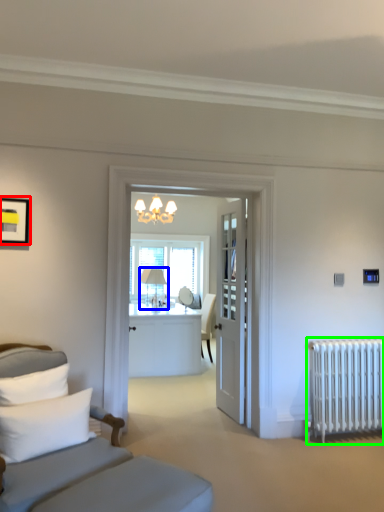
Question: Estimate the real-world distances between objects in this image. Which object is farther from picture frame (highlighted by a red box), table lamp (highlighted by a blue box) or radiator (highlighted by a green box)?

Choices:
 (A) table lamp
 (B) radiator

Answer: (B)